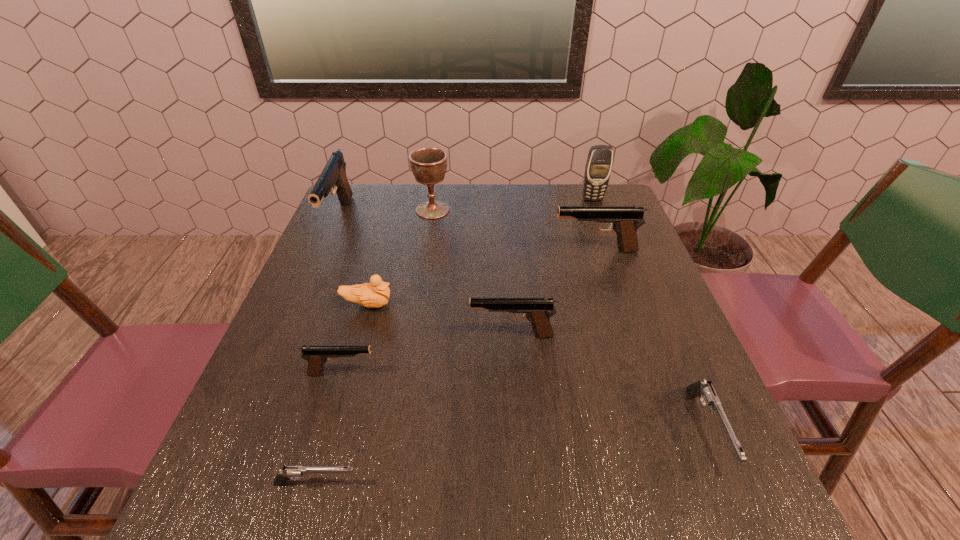
Identify the location of cellular telephone that is at the right edge. (598, 167).

This screenshot has width=960, height=540. In order to click on object that is at the far left corner in this screenshot , I will do `click(333, 175)`.

Where is `object that is at the near left corner`? object that is at the near left corner is located at coordinates (289, 472).

Where is `object located in the far right corner section of the desktop`? object located in the far right corner section of the desktop is located at coordinates (598, 167).

The image size is (960, 540). I want to click on object positioned at the near right corner, so click(x=706, y=392).

Where is `vacant area at the far edge`? vacant area at the far edge is located at coordinates (449, 225).

This screenshot has width=960, height=540. In order to click on free space at the left edge of the desktop in this screenshot , I will do `click(334, 262)`.

This screenshot has width=960, height=540. I want to click on free space at the right edge of the desktop, so click(602, 235).

The width and height of the screenshot is (960, 540). Find the location of `free space at the far left corner`. free space at the far left corner is located at coordinates (368, 193).

Locate an element on the screen. This screenshot has width=960, height=540. vacant space that is in between the third farthest black pistol and the bigger silver pistol is located at coordinates (610, 383).